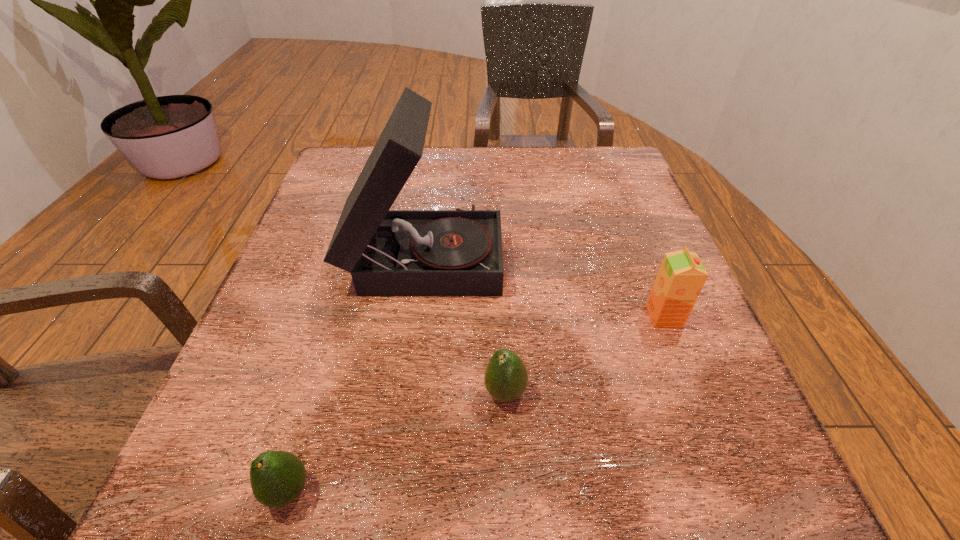
Locate an element on the screen. Image resolution: width=960 pixels, height=540 pixels. vacant space that satisfies the following two spatial constraints: 1. on the front-facing side of the phonograph_record; 2. on the right side of the third shortest object is located at coordinates (416, 316).

This screenshot has width=960, height=540. I want to click on free space that satisfies the following two spatial constraints: 1. on the front-facing side of the phonograph_record; 2. on the left side of the farther avocado, so click(x=405, y=393).

Where is `vacant region that satisfies the following two spatial constraints: 1. on the back side of the farther avocado; 2. on the front-facing side of the farthest object`? The image size is (960, 540). vacant region that satisfies the following two spatial constraints: 1. on the back side of the farther avocado; 2. on the front-facing side of the farthest object is located at coordinates (498, 254).